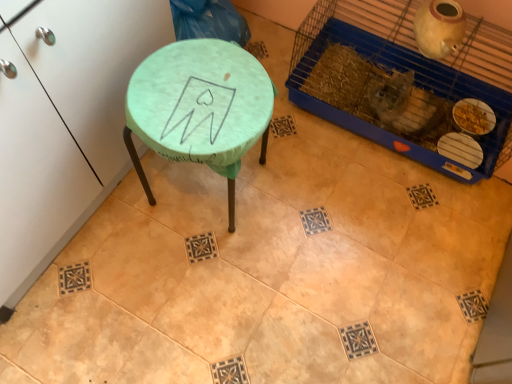
In order to click on free location to the left of matte green stool at center in this screenshot , I will do `click(122, 210)`.